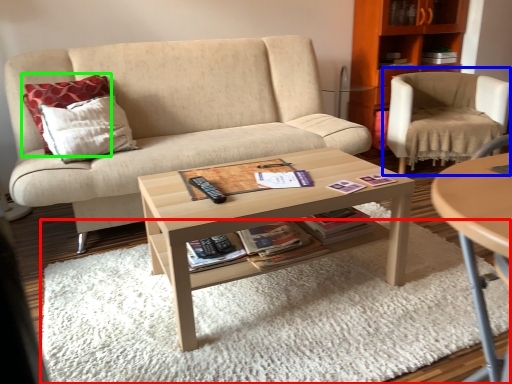
Question: Which is nearer to the plain (highlighted by a red box)? chair (highlighted by a blue box) or pillow (highlighted by a green box).

Choices:
 (A) chair
 (B) pillow

Answer: (B)